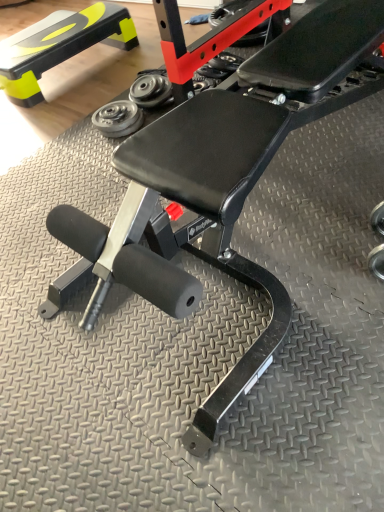
Question: From the image's perspective, is matte black step at upper left beneath metallic silver weight at center, acting as the 1th dumbbell starting from the top?

Choices:
 (A) no
 (B) yes

Answer: (A)

Question: Is matte black step at upper left to the right of metallic silver weight at center, which appears as the 2th dumbbell when ordered from the bottom, from the viewer's perspective?

Choices:
 (A) no
 (B) yes

Answer: (A)

Question: Considering the relative sizes of matte black step at upper left and metallic silver weight at center, acting as the 1th dumbbell starting from the top, in the image provided, is matte black step at upper left thinner than metallic silver weight at center, acting as the 1th dumbbell starting from the top,?

Choices:
 (A) yes
 (B) no

Answer: (B)

Question: Is the position of matte black step at upper left less distant than that of metallic silver weight at center, which appears as the 2th dumbbell when ordered from the bottom?

Choices:
 (A) no
 (B) yes

Answer: (A)

Question: Is the depth of matte black step at upper left greater than that of metallic silver weight at center, acting as the 1th dumbbell starting from the top?

Choices:
 (A) no
 (B) yes

Answer: (B)

Question: Is silver metallic dumbbell at center, which appears as the first dumbbell when ordered from the bottom, situated inside matte black step at upper left or outside?

Choices:
 (A) inside
 (B) outside

Answer: (B)

Question: Looking at their shapes, would you say silver metallic dumbbell at center, which appears as the first dumbbell when ordered from the bottom, is wider or thinner than matte black step at upper left?

Choices:
 (A) thin
 (B) wide

Answer: (A)

Question: In terms of size, does silver metallic dumbbell at center, which appears as the first dumbbell when ordered from the bottom, appear bigger or smaller than matte black step at upper left?

Choices:
 (A) big
 (B) small

Answer: (B)

Question: From a real-world perspective, relative to matte black step at upper left, is silver metallic dumbbell at center, which appears as the first dumbbell when ordered from the bottom, vertically above or below?

Choices:
 (A) below
 (B) above

Answer: (A)

Question: In terms of size, does matte black step at upper left appear bigger or smaller than metallic silver weight at center, which appears as the 2th dumbbell when ordered from the bottom?

Choices:
 (A) big
 (B) small

Answer: (A)

Question: Is matte black step at upper left taller or shorter than metallic silver weight at center, acting as the 1th dumbbell starting from the top?

Choices:
 (A) short
 (B) tall

Answer: (B)

Question: Considering the positions of matte black step at upper left and metallic silver weight at center, acting as the 1th dumbbell starting from the top, in the image, is matte black step at upper left wider or thinner than metallic silver weight at center, acting as the 1th dumbbell starting from the top,?

Choices:
 (A) wide
 (B) thin

Answer: (A)

Question: Relative to metallic silver weight at center, which appears as the 2th dumbbell when ordered from the bottom, is matte black step at upper left in front or behind?

Choices:
 (A) front
 (B) behind

Answer: (B)

Question: In terms of width, does metallic silver weight at center, which appears as the 2th dumbbell when ordered from the bottom, look wider or thinner when compared to matte black step at upper left?

Choices:
 (A) thin
 (B) wide

Answer: (A)

Question: Considering the relative positions of metallic silver weight at center, acting as the 1th dumbbell starting from the top, and matte black step at upper left in the image provided, is metallic silver weight at center, acting as the 1th dumbbell starting from the top, to the left or to the right of matte black step at upper left?

Choices:
 (A) left
 (B) right

Answer: (B)